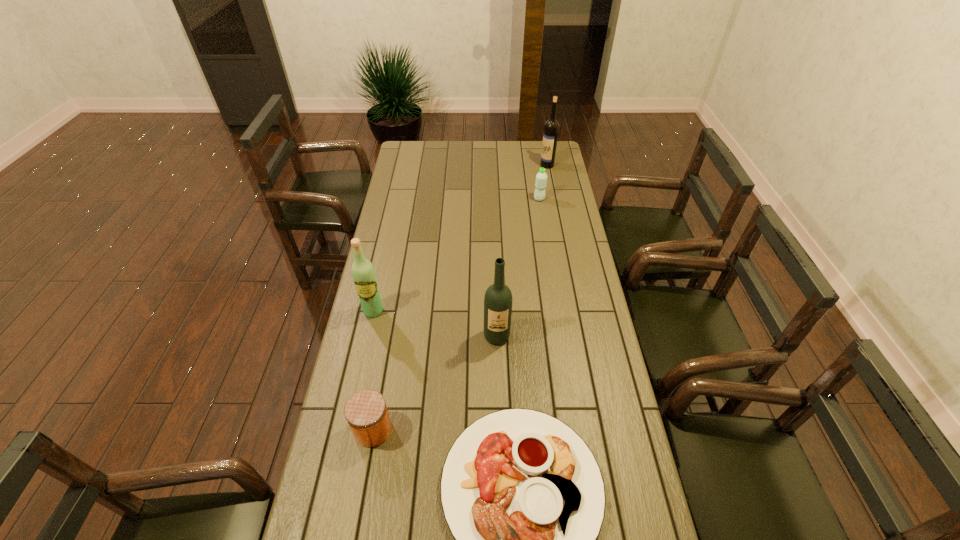
This screenshot has width=960, height=540. What are the coordinates of `water bottle at the right edge` in the screenshot? It's located at (541, 178).

Where is `object that is at the far right corner`? object that is at the far right corner is located at coordinates (551, 128).

Image resolution: width=960 pixels, height=540 pixels. In order to click on vacant area at the far edge in this screenshot , I will do `click(513, 152)`.

Locate an element on the screen. The width and height of the screenshot is (960, 540). free space at the left edge of the desktop is located at coordinates (424, 176).

Find the location of a particular element. The height and width of the screenshot is (540, 960). vacant region at the right edge of the desktop is located at coordinates (563, 223).

This screenshot has width=960, height=540. In order to click on free space between the farthest object and the fourth farthest object in this screenshot , I will do `click(522, 251)`.

Find the location of a particular element. This screenshot has width=960, height=540. empty location between the second wine bottle from right to left and the rightmost wine bottle is located at coordinates (522, 251).

You are a GUI agent. You are given a task and a screenshot of the screen. Output one action in this format:
    pyautogui.click(x=<x>, y=<y>)
    Task: Click on the free point between the fourth nearest object and the rightmost wine bottle
    This screenshot has width=960, height=540.
    Given the screenshot: What is the action you would take?
    pyautogui.click(x=460, y=238)

Where is `free space that is in between the third farthest object and the jar`? The width and height of the screenshot is (960, 540). free space that is in between the third farthest object and the jar is located at coordinates (373, 370).

Identify the location of vacant space that is in between the fifth tallest object and the leftmost wine bottle. (373, 370).